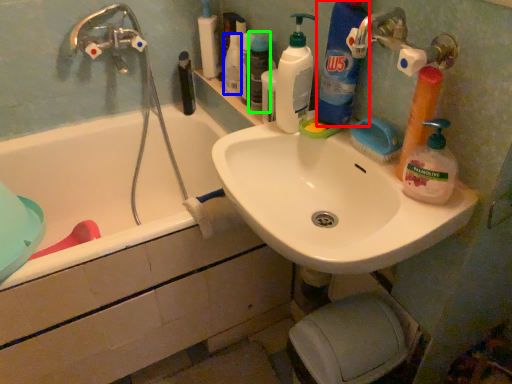
Question: Based on their relative distances, which object is farther from cleaning product (highlighted by a red box)? Choose from toiletry (highlighted by a blue box) and toiletry (highlighted by a green box).

Choices:
 (A) toiletry
 (B) toiletry

Answer: (A)